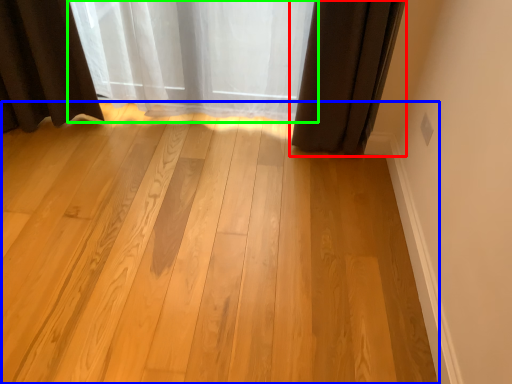
Question: Which object is positioned closest to curtain (highlighted by a red box)? Select from plank (highlighted by a blue box) and curtain (highlighted by a green box).

Choices:
 (A) plank
 (B) curtain

Answer: (B)